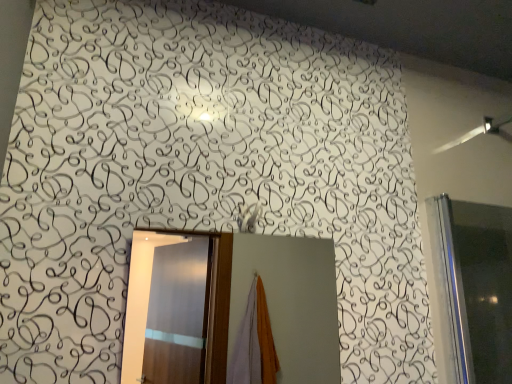
Measure the distance between wooden door at center and camera.

They are 1.94 meters apart.

What do you see at coordinates (246, 296) in the screenshot? This screenshot has width=512, height=384. I see `wooden door at center` at bounding box center [246, 296].

This screenshot has height=384, width=512. I want to click on wooden door at center, so click(x=246, y=296).

I want to click on wooden door at center, so click(x=246, y=296).